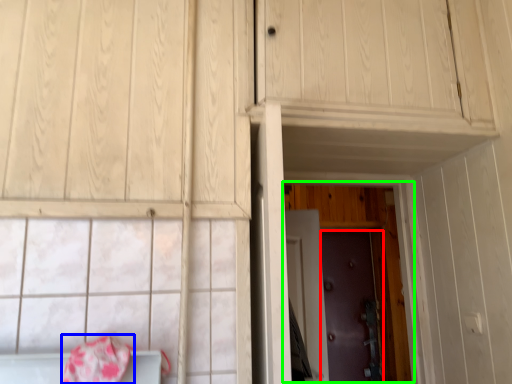
Question: Which is nearer to the door (highlighted by a red box)? blanket (highlighted by a blue box) or door (highlighted by a green box).

Choices:
 (A) blanket
 (B) door

Answer: (B)